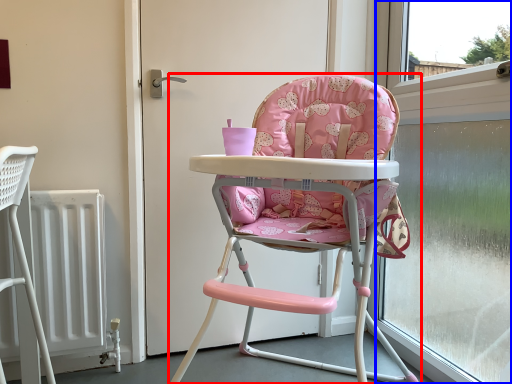
Question: Which point is closer to the camera, chair (highlighted by a red box) or window screen (highlighted by a blue box)?

Choices:
 (A) chair
 (B) window screen

Answer: (A)